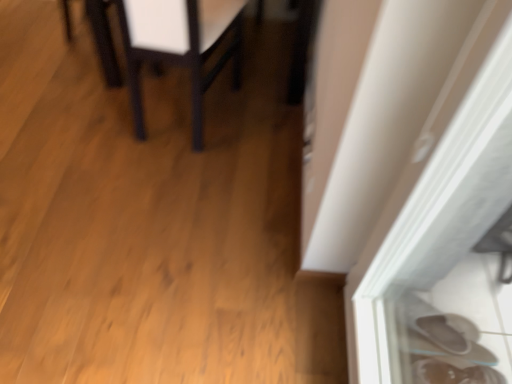
At what (x,y) coordinates should I click in order to perform the action: click on free spot below matte black table at upper left (from a real-world perspective). Please return your answer as a coordinate pair (x, y). Looking at the image, I should click on (179, 113).